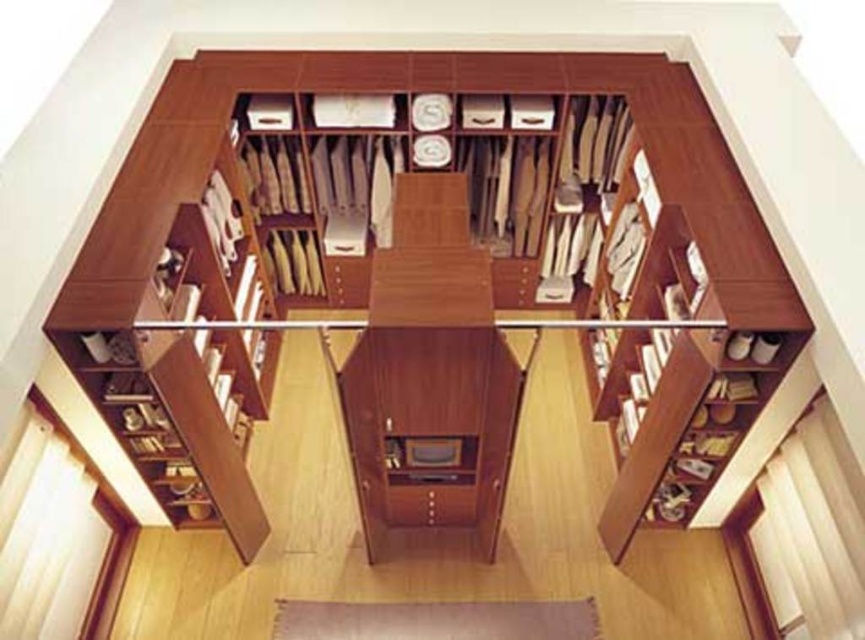
Question: Which of the following is the closest to the observer?

Choices:
 (A) matte wood drawer at center
 (B) wooden bookshelf at center

Answer: (B)

Question: Is wooden bookshelf at center wider than matte wood drawer at center?

Choices:
 (A) no
 (B) yes

Answer: (B)

Question: Which point appears closest to the camera in this image?

Choices:
 (A) [x=398, y=520]
 (B) [x=189, y=384]

Answer: (B)

Question: Does wooden bookshelf at center appear on the right side of matte wood drawer at center?

Choices:
 (A) yes
 (B) no

Answer: (A)

Question: Which of the following is the closest to the observer?

Choices:
 (A) (750, 284)
 (B) (473, 499)

Answer: (A)

Question: Does wooden bookshelf at center have a larger size compared to matte wood drawer at center?

Choices:
 (A) no
 (B) yes

Answer: (B)